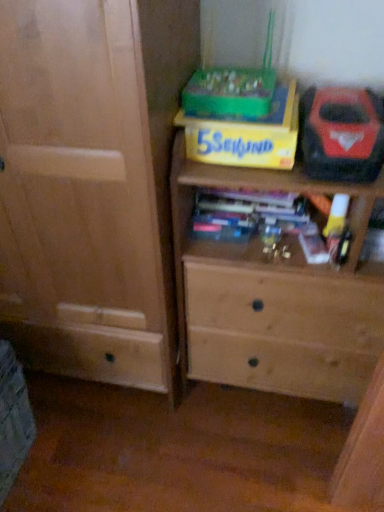
Question: Is red plastic tool at upper right bigger than light brown wood chest of drawers at center?

Choices:
 (A) yes
 (B) no

Answer: (B)

Question: Is red plastic tool at upper right outside of light brown wood chest of drawers at center?

Choices:
 (A) yes
 (B) no

Answer: (B)

Question: From the image's perspective, would you say red plastic tool at upper right is positioned over light brown wood chest of drawers at center?

Choices:
 (A) yes
 (B) no

Answer: (A)

Question: Does red plastic tool at upper right have a greater height compared to light brown wood chest of drawers at center?

Choices:
 (A) yes
 (B) no

Answer: (B)

Question: From a real-world perspective, is red plastic tool at upper right beneath light brown wood chest of drawers at center?

Choices:
 (A) yes
 (B) no

Answer: (B)

Question: Is red plastic tool at upper right taller or shorter than yellow cardboard box at upper center?

Choices:
 (A) short
 (B) tall

Answer: (B)

Question: From a real-world perspective, relative to yellow cardboard box at upper center, is red plastic tool at upper right vertically above or below?

Choices:
 (A) above
 (B) below

Answer: (A)

Question: Is red plastic tool at upper right bigger or smaller than yellow cardboard box at upper center?

Choices:
 (A) big
 (B) small

Answer: (A)

Question: Considering their positions, is red plastic tool at upper right located in front of or behind yellow cardboard box at upper center?

Choices:
 (A) behind
 (B) front

Answer: (B)

Question: Do you think yellow cardboard box at upper center is within light brown wood chest of drawers at center, or outside of it?

Choices:
 (A) outside
 (B) inside

Answer: (B)

Question: In terms of width, does yellow cardboard box at upper center look wider or thinner when compared to light brown wood chest of drawers at center?

Choices:
 (A) thin
 (B) wide

Answer: (A)

Question: Does point (294, 88) appear closer or farther from the camera than point (235, 366)?

Choices:
 (A) farther
 (B) closer

Answer: (B)

Question: From the image's perspective, is yellow cardboard box at upper center located above or below light brown wood chest of drawers at center?

Choices:
 (A) below
 (B) above

Answer: (B)

Question: From a real-world perspective, is light brown wood chest of drawers at center above or below yellow cardboard box at upper center?

Choices:
 (A) above
 (B) below

Answer: (B)

Question: Is light brown wood chest of drawers at center bigger or smaller than yellow cardboard box at upper center?

Choices:
 (A) small
 (B) big

Answer: (B)